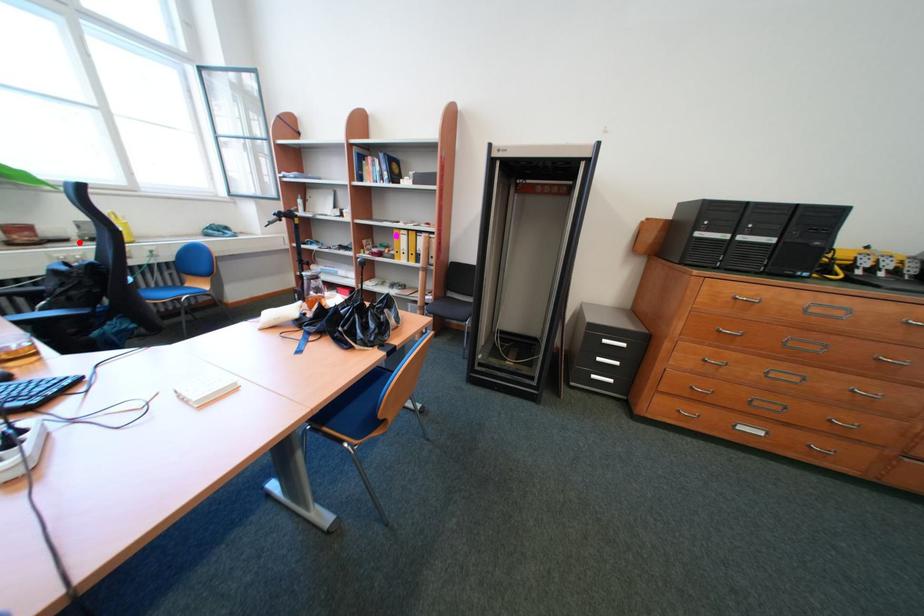
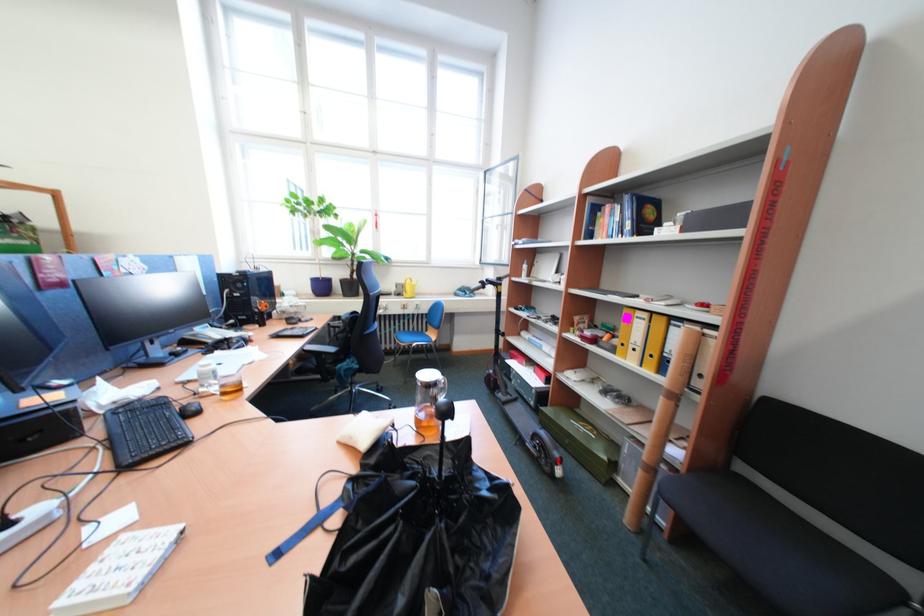
Question: A red point is marked in image1. In image2, is the corresponding 3D point closer to the camera or farther? Reply with the corresponding letter.

Choices:
 (A) The corresponding 3D point is closer.
 (B) The corresponding 3D point is farther.

Answer: (A)